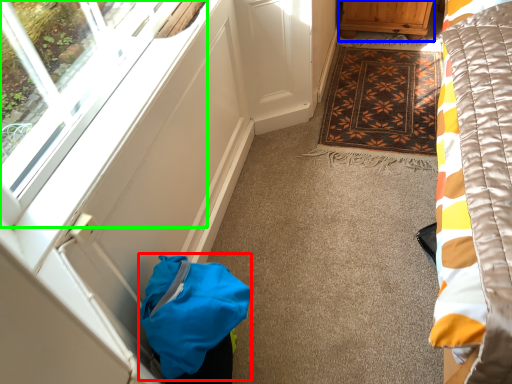
Question: Based on their relative distances, which object is nearer to bag (highlighted by a red box)? Choose from furniture (highlighted by a blue box) and window (highlighted by a green box).

Choices:
 (A) furniture
 (B) window

Answer: (B)